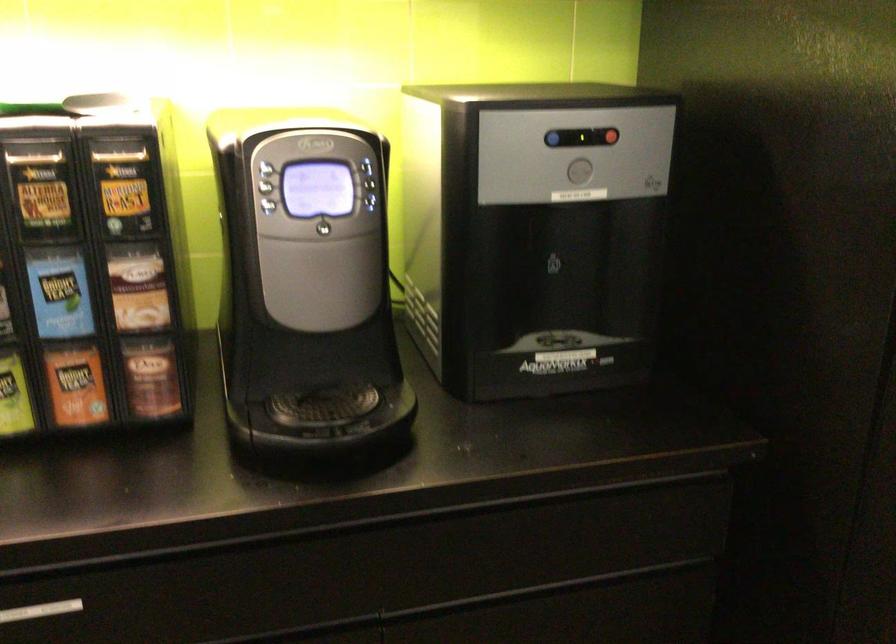
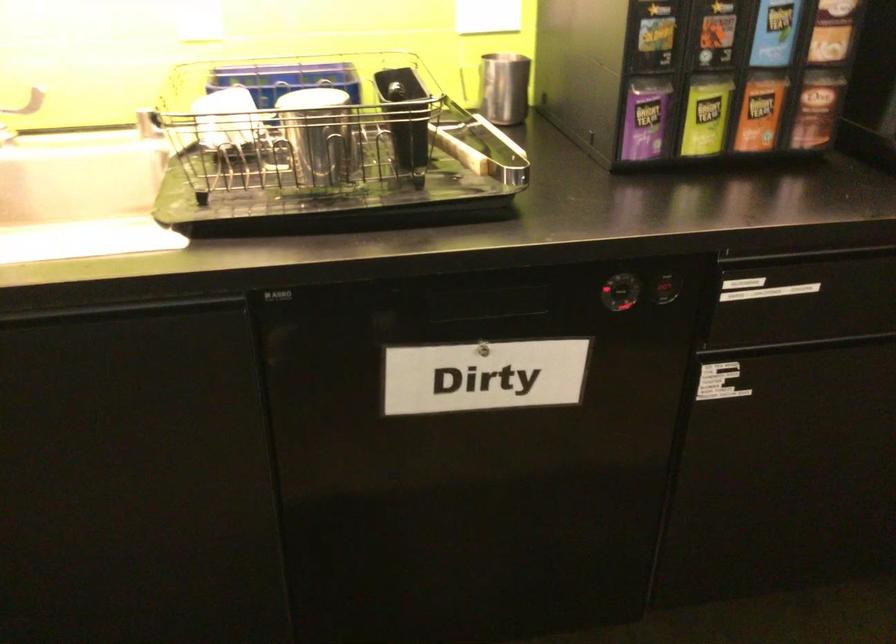
Question: The images are taken continuously from a first-person perspective. In which direction is your viewpoint rotating?

Choices:
 (A) Left
 (B) Right
 (C) Up
 (D) Down

Answer: (D)